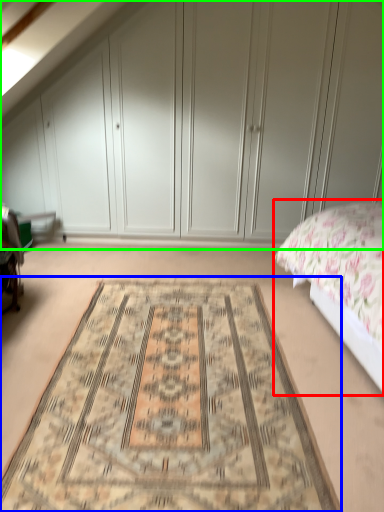
Question: Which object is the farthest from bed (highlighted by a red box)? Choose among these: mat (highlighted by a blue box) or dresser (highlighted by a green box).

Choices:
 (A) mat
 (B) dresser

Answer: (B)